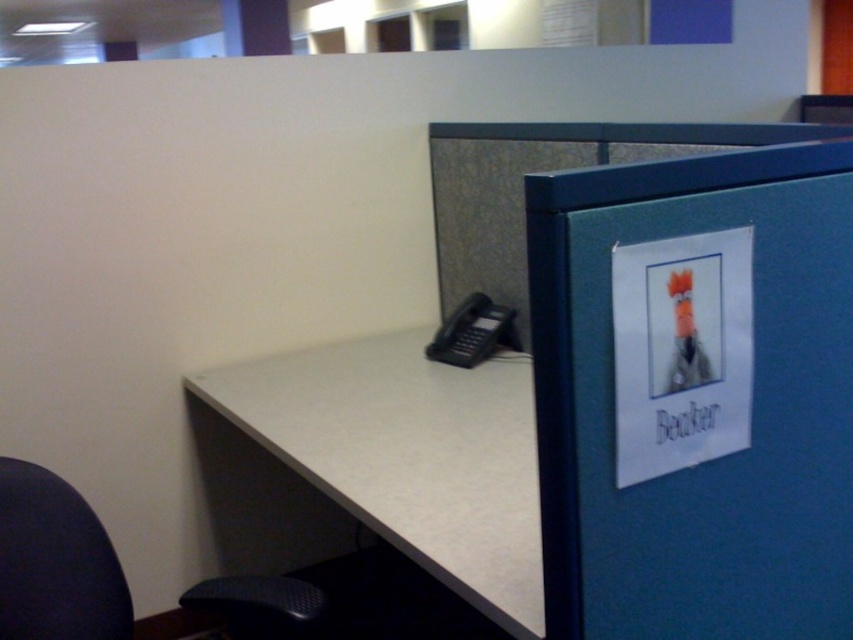
Question: Is blue felt file cabinet at right to the right of white laminate desk at center from the viewer's perspective?

Choices:
 (A) no
 (B) yes

Answer: (B)

Question: Does blue felt file cabinet at right have a greater width compared to white laminate desk at center?

Choices:
 (A) no
 (B) yes

Answer: (A)

Question: Which point is closer to the camera?

Choices:
 (A) (71, 573)
 (B) (525, 198)
 (C) (259, 419)

Answer: (A)

Question: Which object appears closest to the camera in this image?

Choices:
 (A) white laminate desk at center
 (B) blue felt file cabinet at right

Answer: (B)

Question: Estimate the real-world distances between objects in this image. Which object is closer to the white laminate desk at center?

Choices:
 (A) blue felt file cabinet at right
 (B) dark blue fabric swivel chair at lower left

Answer: (B)

Question: Observing the image, what is the correct spatial positioning of blue felt file cabinet at right in reference to dark blue fabric swivel chair at lower left?

Choices:
 (A) right
 (B) left

Answer: (A)